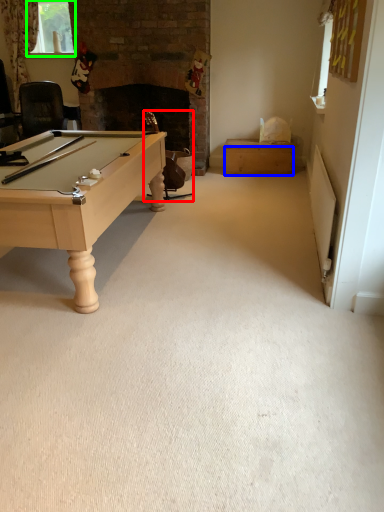
Question: Based on their relative distances, which object is farther from swivel chair (highlighted by a red box)? Choose from drawer (highlighted by a blue box) and window screen (highlighted by a green box).

Choices:
 (A) drawer
 (B) window screen

Answer: (B)